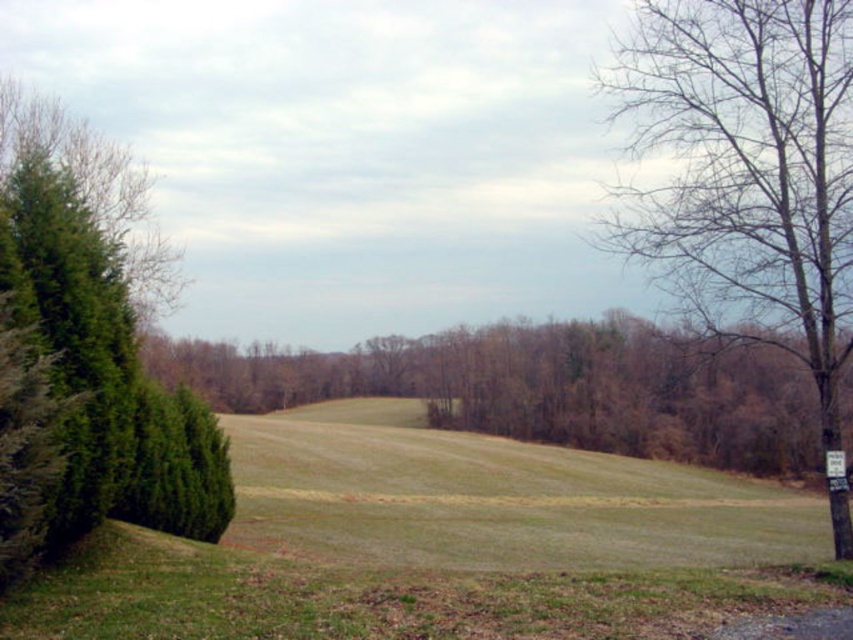
You are a bird seeking shelter from the rain. You see a bare wood tree at right and a green leafy tree at center. Which tree would provide better shelter based on their positions?

The green leafy tree at center is further away from you than the bare wood tree at right. Since the bare wood tree at right is closer, it would be the first option for shelter, but the green leafy tree at center might offer better protection due to its leafy canopy. However, the question focuses on position, so the closer tree is the bare wood tree at right.

You are a landscape architect designing a new garden. You have a bare wood tree at right and a green textured hedge at left. Which object is wider in the image?

The bare wood tree at right is wider than the green textured hedge at left according to the description.

You are a bird looking for a nesting spot. You see the bare wood tree at right and the green textured hedge at left. Which one is taller?

The bare wood tree at right is taller than the green textured hedge at left.